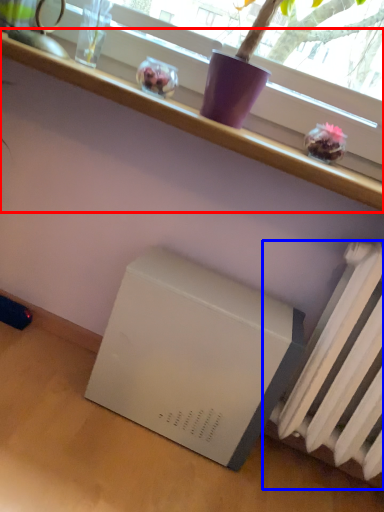
Question: Which object is closer to the camera taking this photo, furniture (highlighted by a red box) or radiator (highlighted by a blue box)?

Choices:
 (A) furniture
 (B) radiator

Answer: (B)